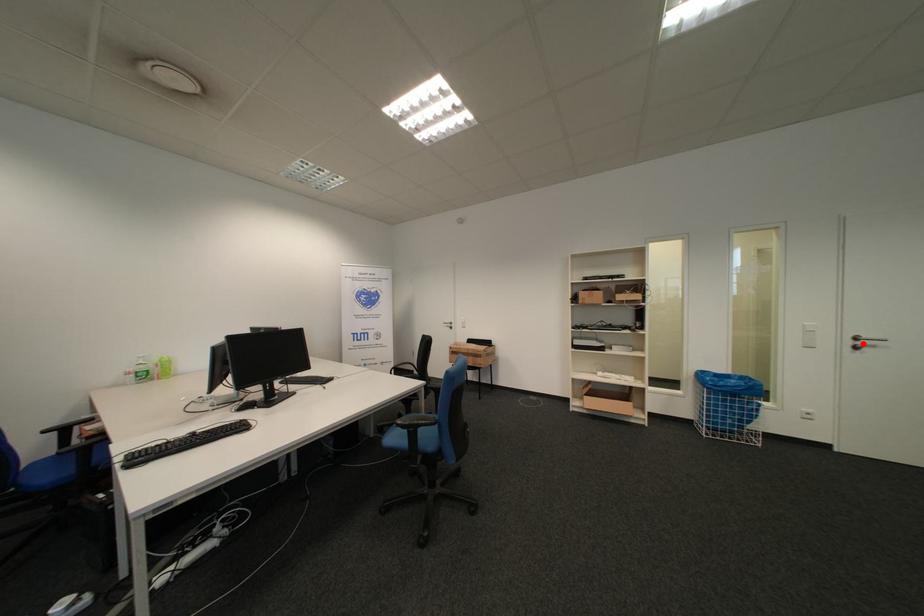
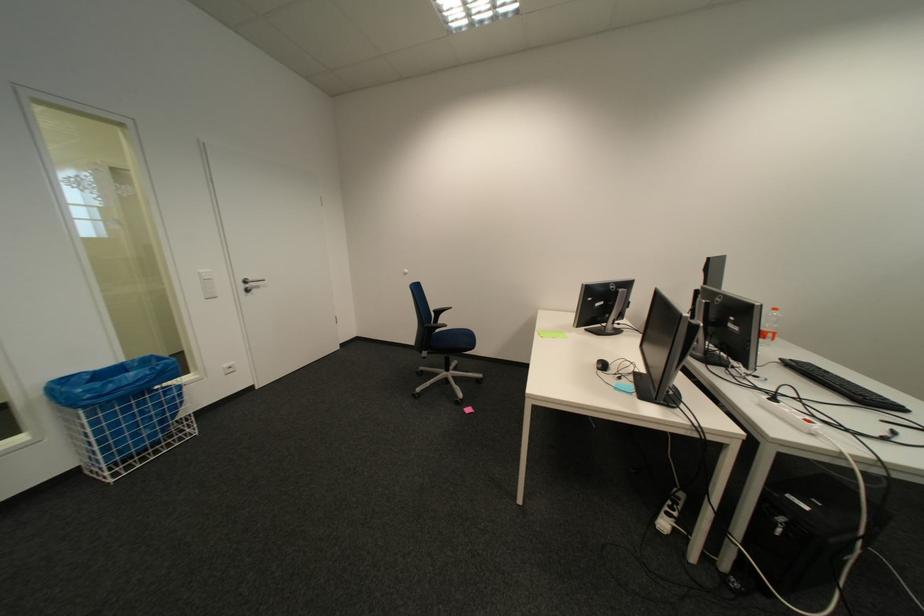
Where in the second image is the point corresponding to the highlighted location from the first image?

(254, 286)